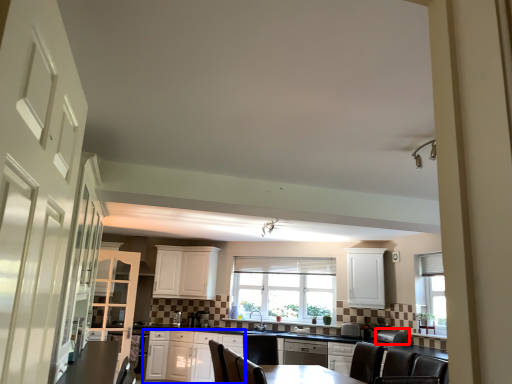
Question: Which object appears closest to the camera in this image, appliance (highlighted by a red box) or cabinetry (highlighted by a blue box)?

Choices:
 (A) appliance
 (B) cabinetry

Answer: (A)